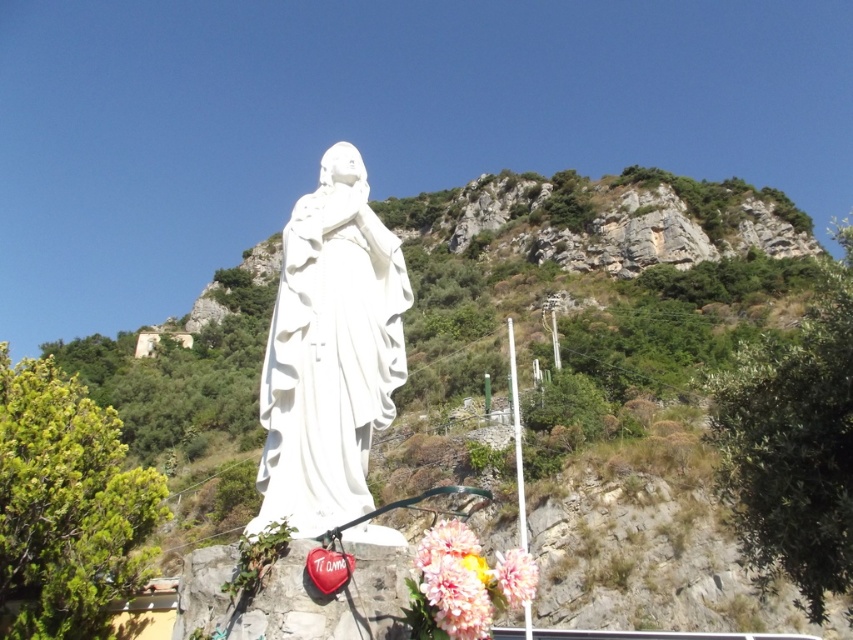
Question: Is green leafy hillside at center smaller than white marble statue at center?

Choices:
 (A) no
 (B) yes

Answer: (A)

Question: Estimate the real-world distances between objects in this image. Which object is farther from the pastel pink fabric flowers at lower center?

Choices:
 (A) green leafy hillside at center
 (B) fluffy silk flower at lower center

Answer: (A)

Question: Is pastel pink fabric flowers at lower center bigger than fluffy silk flower at lower center?

Choices:
 (A) yes
 (B) no

Answer: (B)

Question: Which point appears farthest from the camera in this image?

Choices:
 (A) (534, 337)
 (B) (454, 518)

Answer: (A)

Question: Which object is farther from the camera taking this photo?

Choices:
 (A) fluffy silk flower at lower center
 (B) pastel pink fabric flowers at lower center
 (C) white marble statue at center
 (D) green leafy hillside at center

Answer: (D)

Question: Does white marble statue at center have a smaller size compared to pastel pink fabric flowers at lower center?

Choices:
 (A) no
 (B) yes

Answer: (A)